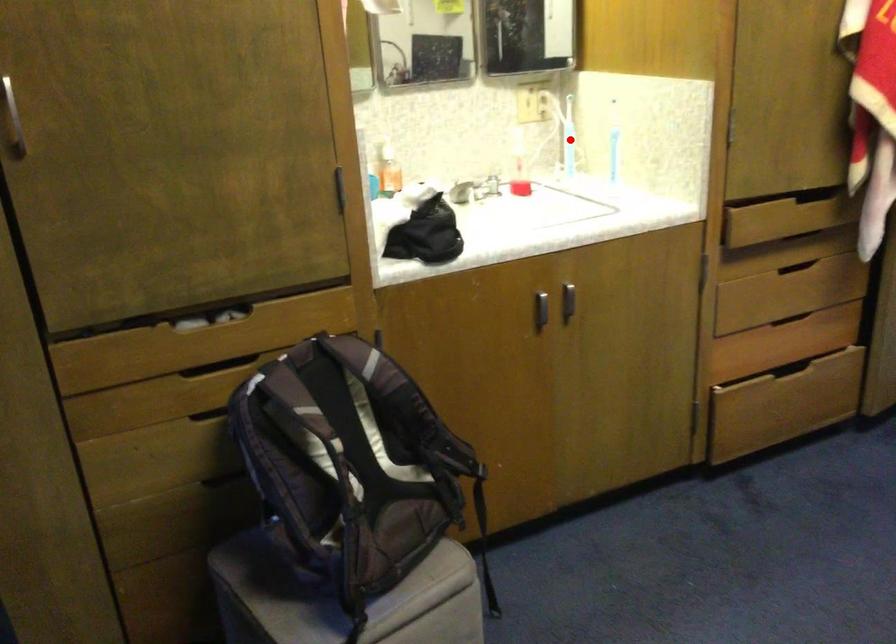
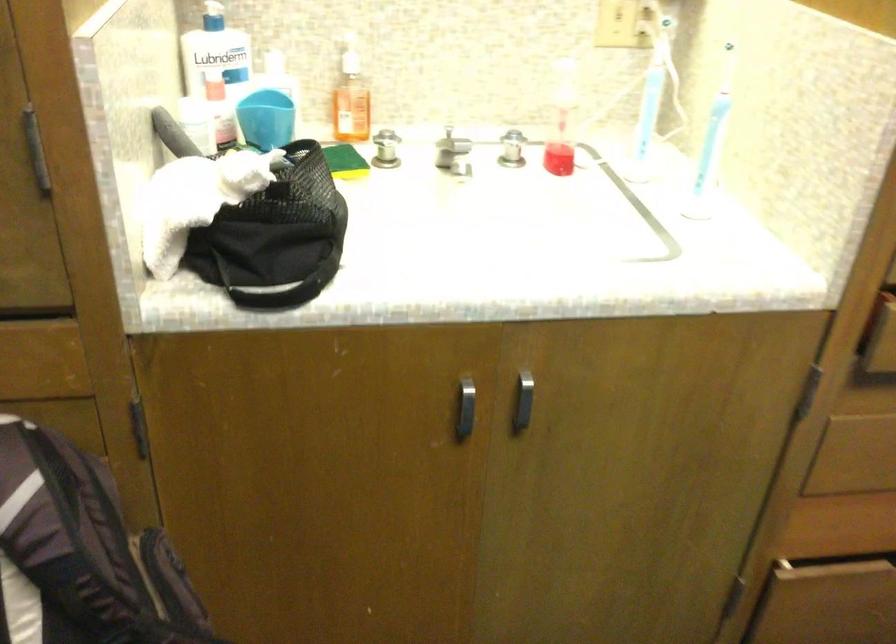
Question: I am providing you with two images of the same scene from different viewpoints. In image1, a red point is highlighted. Considering the same 3D point in image2, which of the following is correct?

Choices:
 (A) It is closer
 (B) It is farther

Answer: (A)